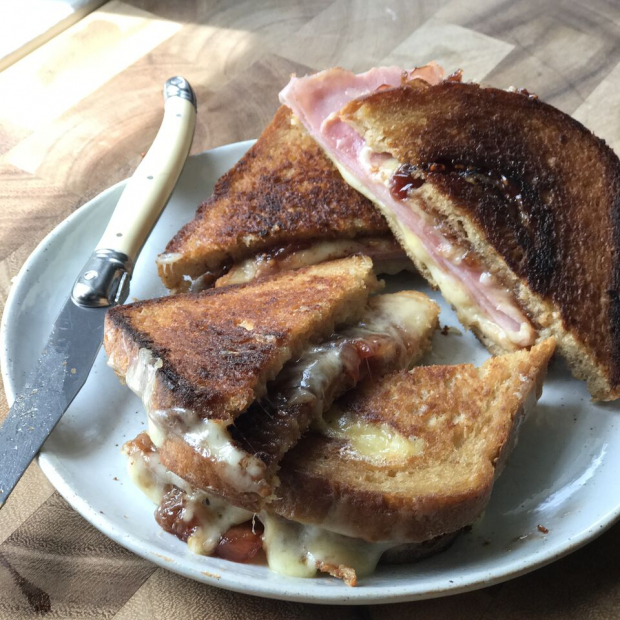
I want to click on crumb, so click(541, 528).